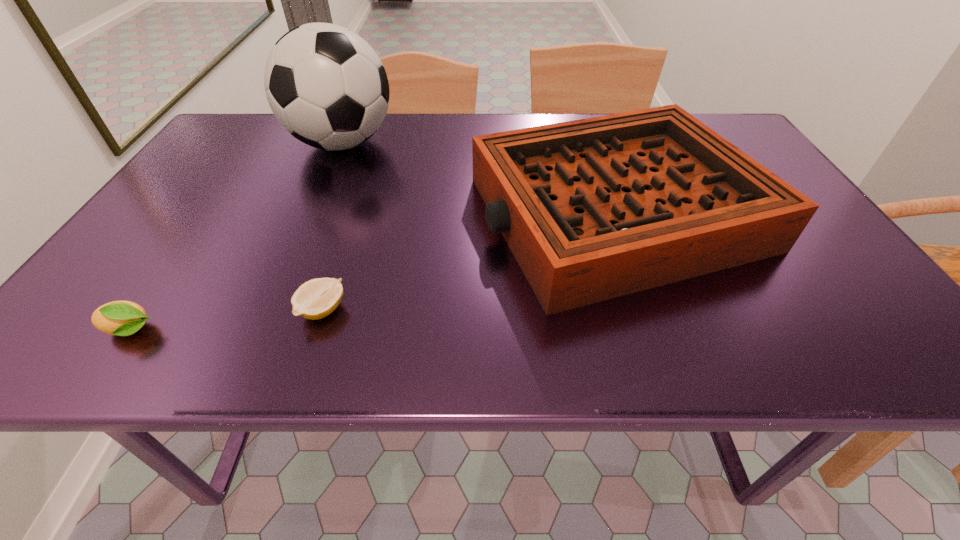
Where is `soccer ball`? The width and height of the screenshot is (960, 540). soccer ball is located at coordinates (327, 87).

Find the location of `the rightmost object`. the rightmost object is located at coordinates (x=592, y=209).

Image resolution: width=960 pixels, height=540 pixels. I want to click on the third shortest object, so click(592, 209).

This screenshot has width=960, height=540. Identify the location of the third tallest object. (121, 318).

Locate an element on the screen. This screenshot has width=960, height=540. the left lemon is located at coordinates (121, 318).

Identify the location of the shortest object. (315, 299).

Identify the location of the shorter lemon. The image size is (960, 540). (315, 299).

Image resolution: width=960 pixels, height=540 pixels. Find the location of `vacant position located on the front of the tallest object`. vacant position located on the front of the tallest object is located at coordinates (321, 194).

The height and width of the screenshot is (540, 960). What are the coordinates of `vacant area situated on the left of the gameboard` in the screenshot? It's located at (393, 213).

Locate an element on the screen. Image resolution: width=960 pixels, height=540 pixels. vacant space located with leaves positioned above the taller lemon is located at coordinates (309, 331).